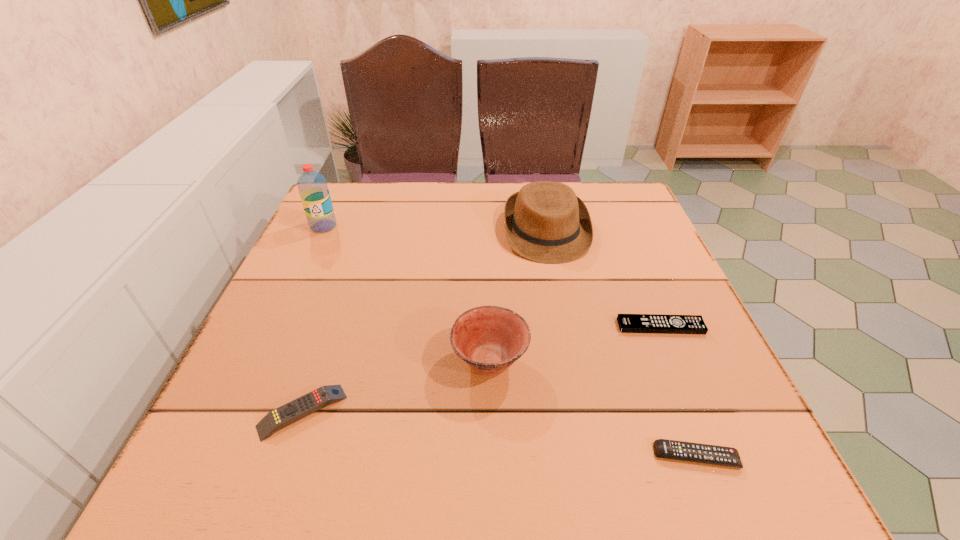
Find the location of a particular element. The width and height of the screenshot is (960, 540). object present at the near right corner is located at coordinates (669, 449).

Identify the location of free space at the far edge of the desktop. (438, 199).

At what (x,y) coordinates should I click in order to perform the action: click on vacant region at the near edge. Please return your answer as a coordinate pair (x, y). The width and height of the screenshot is (960, 540). Looking at the image, I should click on (324, 492).

Where is `vacant space at the left edge of the desktop`? The width and height of the screenshot is (960, 540). vacant space at the left edge of the desktop is located at coordinates (x=332, y=252).

You are a GUI agent. You are given a task and a screenshot of the screen. Output one action in this format:
    pyautogui.click(x=<x>, y=<y>)
    Task: Click on the free space at the right edge of the desktop
    The height and width of the screenshot is (540, 960).
    Given the screenshot: What is the action you would take?
    pyautogui.click(x=670, y=294)

Locate an element on the screen. vacant space at the far left corner is located at coordinates (373, 217).

Where is `vacant area at the far right corner`? vacant area at the far right corner is located at coordinates (605, 200).

The height and width of the screenshot is (540, 960). Identify the location of vacant area that lies between the bowl and the nearest object. (593, 408).

At what (x,y) coordinates should I click in order to perform the action: click on free space between the nearest remote control and the third tallest object. Please return your answer as a coordinate pair (x, y). Image resolution: width=960 pixels, height=540 pixels. Looking at the image, I should click on (593, 408).

The height and width of the screenshot is (540, 960). Identify the location of unoccupied area between the tallest remote control and the tallest object. (x=313, y=319).